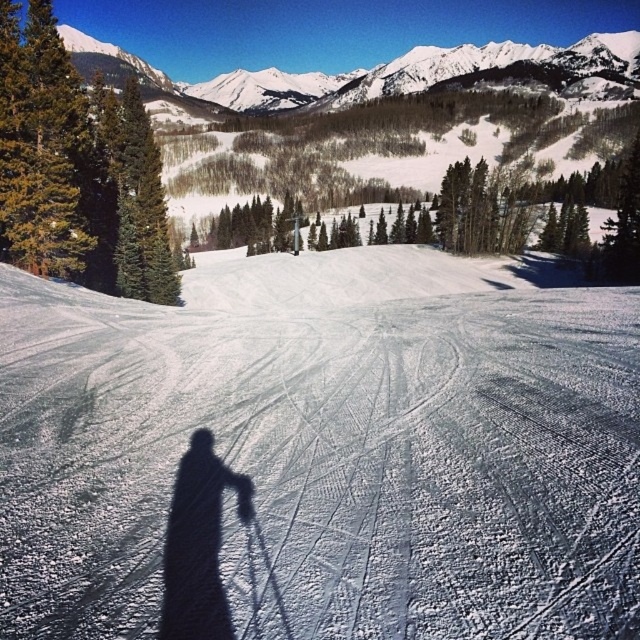
You are a skier planning to descend the slope. You see the white snow at center and the black shadow at center. Which area is wider for you to navigate safely?

The white snow at center is wider than the black shadow at center, so it is safer to navigate the white snow at center area.

You are navigating a drone through the winter landscape shown in the image. You need to fly from point A at coordinates point (449,486) to point B at coordinates point (192,525). Considering the terrain and obstacles, which direction should you fly first to avoid the dense cluster of evergreen trees in the midground?

To avoid the dense cluster of evergreen trees in the midground, you should first fly towards the direction of point B at coordinates point (192,525) before proceeding to point A at coordinates point (449,486). However, according to the objects description, point (449,486) is behind point (192,525), so you should adjust your path to navigate around the trees by moving slightly to the right or left while heading towards point B.